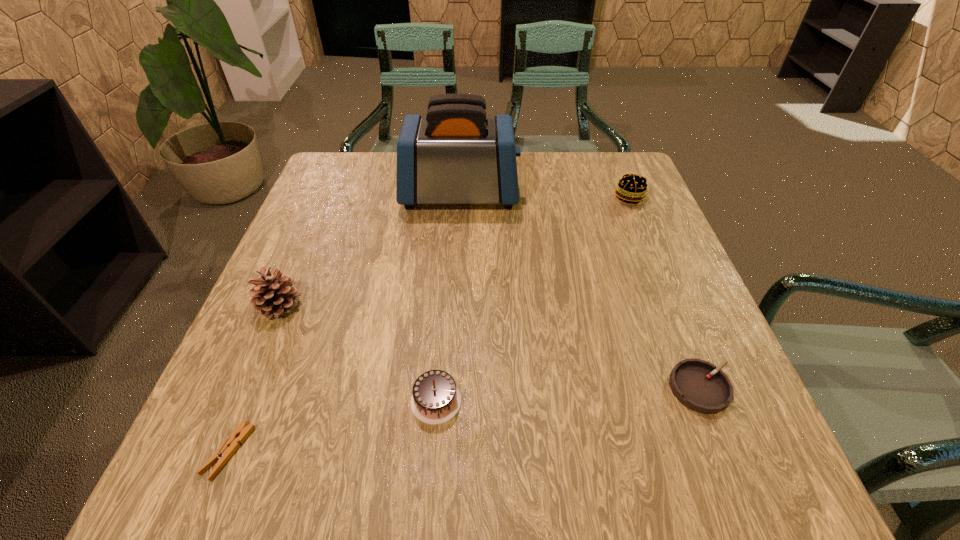
This screenshot has width=960, height=540. I want to click on object positioned at the near left corner, so click(231, 444).

At what (x,y) coordinates should I click in order to perform the action: click on object located at the far right corner. Please return your answer as a coordinate pair (x, y). The image size is (960, 540). Looking at the image, I should click on (631, 188).

In the image, there is a desktop. Find the location of `vacant space at the far edge`. vacant space at the far edge is located at coordinates (564, 153).

Find the location of a particular element. Image resolution: width=960 pixels, height=540 pixels. free location at the near edge of the desktop is located at coordinates (484, 470).

Where is `free point at the left edge`? The image size is (960, 540). free point at the left edge is located at coordinates (331, 204).

Identify the location of vacant space at the right edge of the desktop. (643, 378).

This screenshot has height=540, width=960. I want to click on vacant space at the far left corner of the desktop, so click(x=364, y=153).

Find the location of a particular element. The image size is (960, 540). vacant space at the far right corner is located at coordinates (599, 175).

This screenshot has height=540, width=960. I want to click on empty space between the clothespin and the fourth nearest object, so click(x=254, y=379).

I want to click on free space between the patty and the tallest object, so click(x=544, y=196).